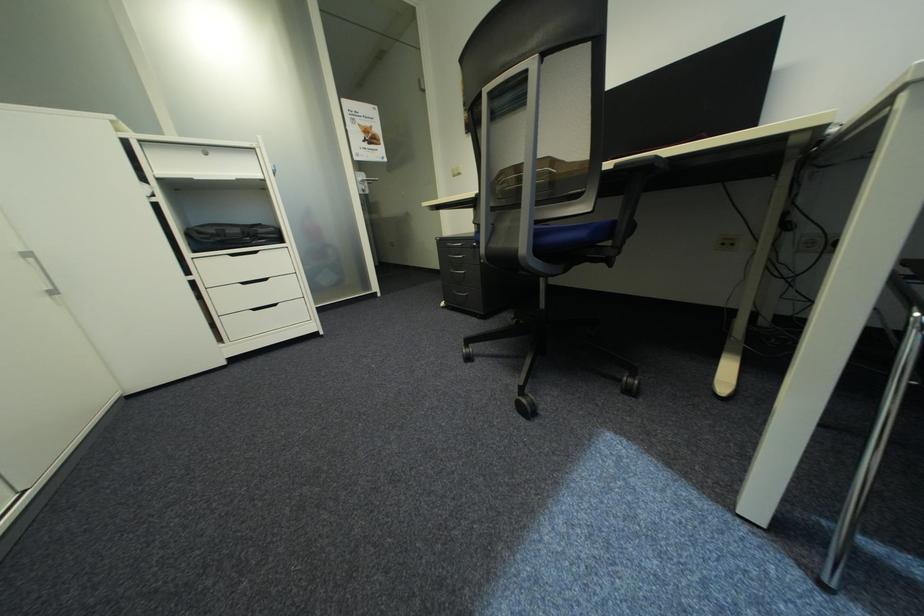
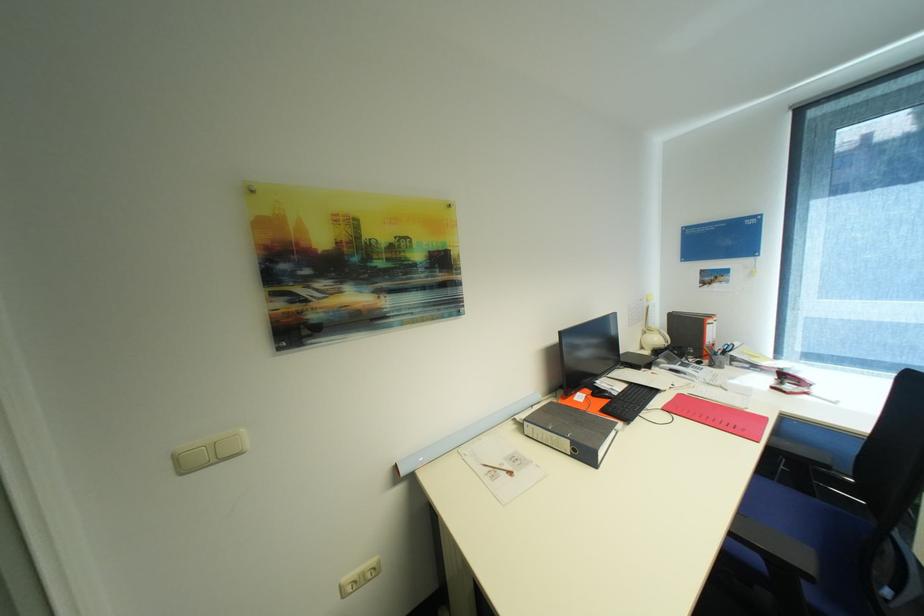
In the second image, find the point that corresponds to (459,172) in the first image.

(185, 458)